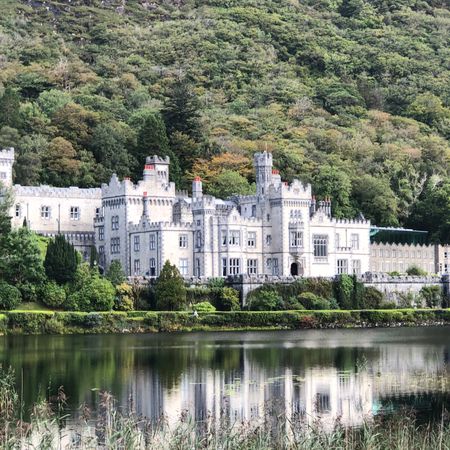
This screenshot has height=450, width=450. Find the location of `door`. door is located at coordinates (297, 268).